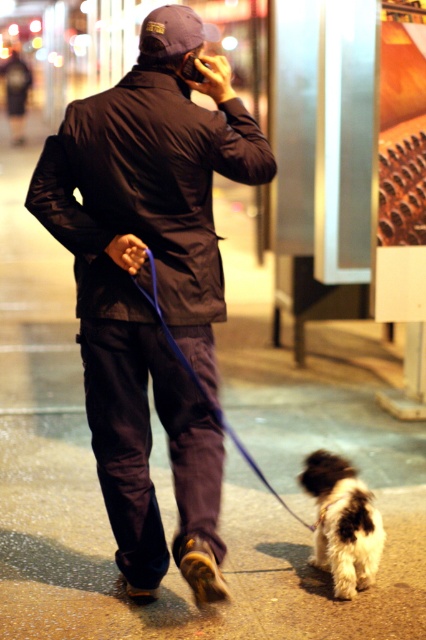
Is fluffy white dog at lower right shorter than blue fabric leash at lower center?

Yes.

Is point (321, 502) farther from viewer compared to point (150, 256)?

Yes, it is behind point (150, 256).

Find the location of `fluffy white dog at lower right`. fluffy white dog at lower right is located at coordinates (342, 522).

What are the coordinates of `fluffy white dog at lower right` in the screenshot? It's located at (342, 522).

Does matte black jacket at center appear on the right side of blue fabric leash at lower center?

Incorrect, matte black jacket at center is not on the right side of blue fabric leash at lower center.

How far apart are matte black jacket at center and blue fabric leash at lower center?

matte black jacket at center is 48.57 centimeters from blue fabric leash at lower center.

Does point (186, 84) come closer to viewer compared to point (134, 278)?

No, it is behind (134, 278).

The image size is (426, 640). I want to click on matte black jacket at center, so click(149, 284).

Is matte black jacket at center to the right of fluffy white dog at lower right from the viewer's perspective?

In fact, matte black jacket at center is to the left of fluffy white dog at lower right.

Which of these two, matte black jacket at center or fluffy white dog at lower right, stands shorter?

With less height is fluffy white dog at lower right.

You are a GUI agent. You are given a task and a screenshot of the screen. Output one action in this format:
    pyautogui.click(x=<x>, y=<y>)
    Task: Click on the matte black jacket at center
    The width and height of the screenshot is (426, 640).
    Given the screenshot: What is the action you would take?
    pyautogui.click(x=149, y=284)